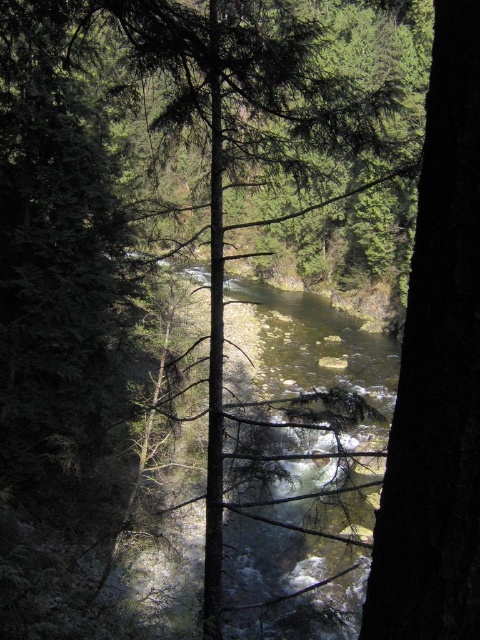
You are a hiker who wants to cross the river using a narrow path. You see the translucent water at center and the dark brown bark tree at right. Which object is wider, and can you safely cross the river if the path is narrower than the tree?

The translucent water at center might be wider than the dark brown bark tree at right. Since the path is narrower than the tree, it may not be wide enough for safe crossing. Consider finding a wider path or alternative route.

You are a hiker trying to cross the river using the dark brown bark tree at right as a reference point. The translucent water at center is where you need to step. Considering their sizes, which one would you focus on to ensure a stable crossing?

The translucent water at center is bigger than the dark brown bark tree at right, so focusing on the larger area of translucent water at center would provide a more stable crossing since it offers a wider and more secure stepping area.

You are standing in the forest and see the translucent water at center and the dark brown bark tree at right. Which object is positioned lower in the scene?

The translucent water at center is positioned below the dark brown bark tree at right, so it is lower in the scene.